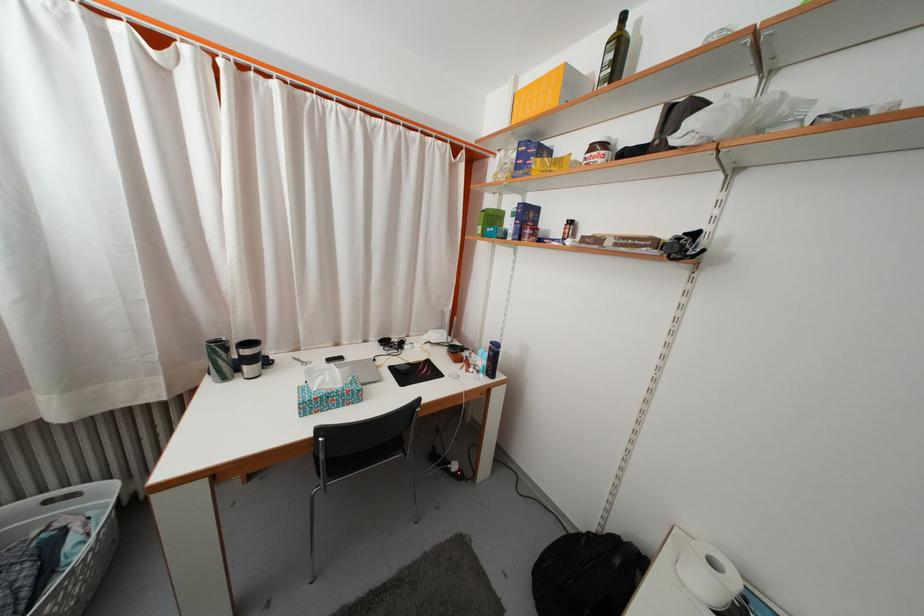
At what (x,y) coordinates should I click in order to perform the action: click on green cardboard box. Please return your answer as a coordinate pair (x, y). The image size is (924, 616). Looking at the image, I should click on (490, 221).